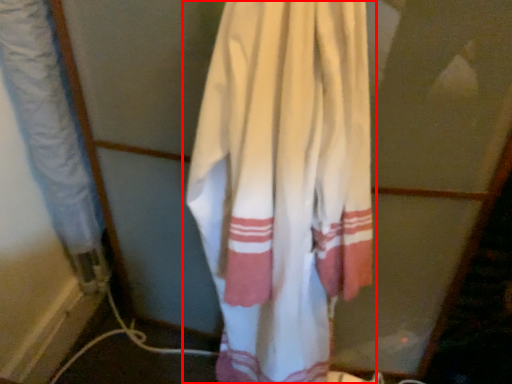
Question: Considering the relative positions of curtain (annotated by the red box) and curtain in the image provided, where is curtain (annotated by the red box) located with respect to the staircase?

Choices:
 (A) right
 (B) left

Answer: (A)